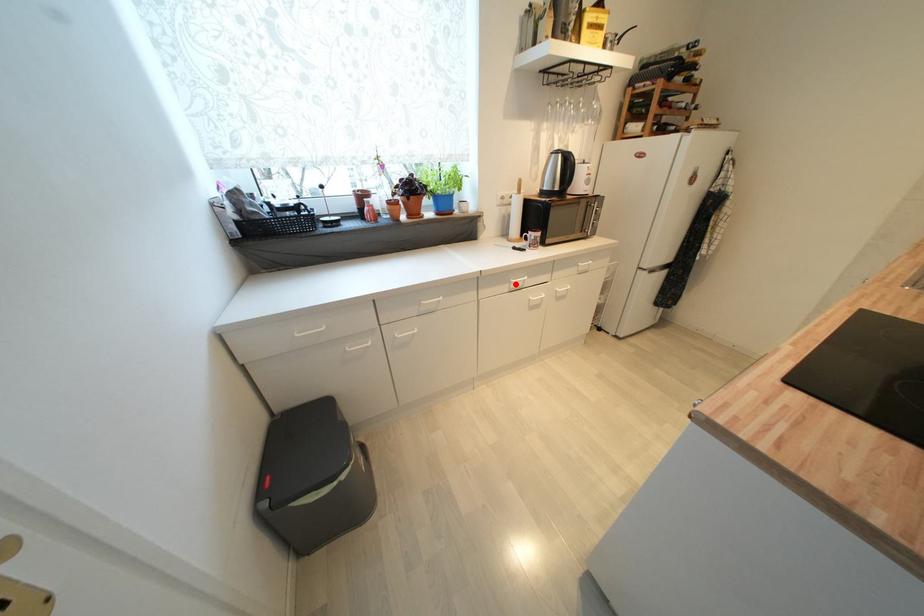
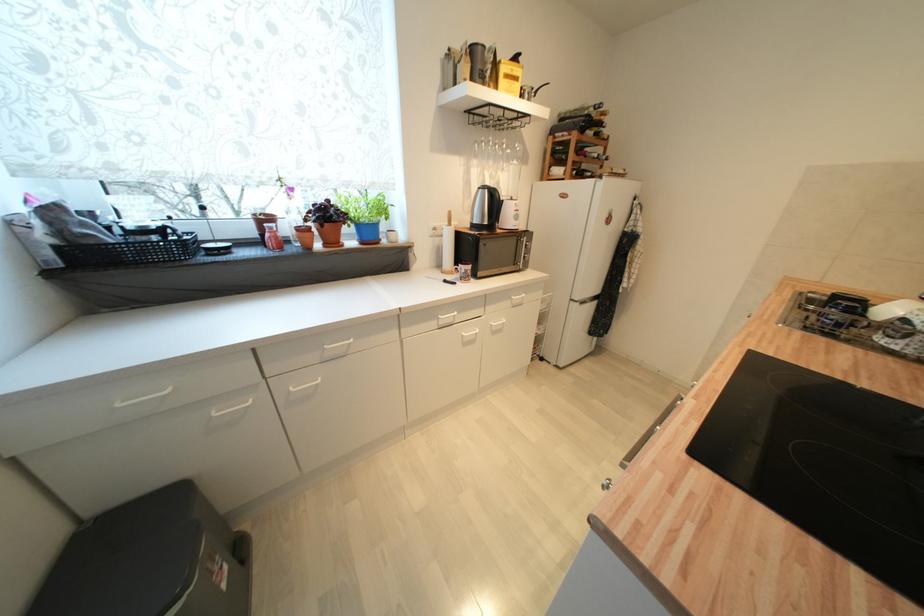
In the second image, find the point that corresponds to the highlighted location in the first image.

(444, 321)